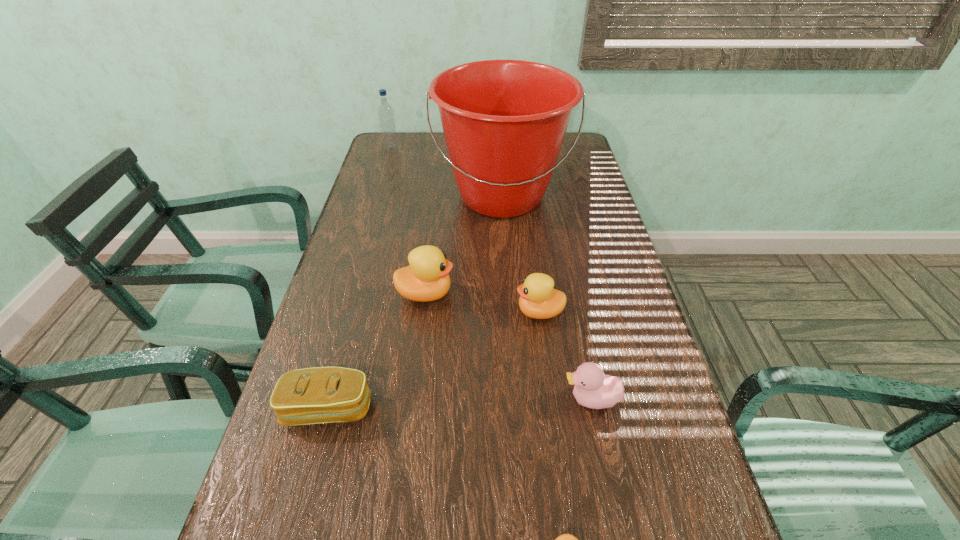
Image resolution: width=960 pixels, height=540 pixels. I want to click on water bottle located in the far edge section of the desktop, so click(x=386, y=118).

The height and width of the screenshot is (540, 960). What are the coordinates of `water bottle that is at the left edge` in the screenshot? It's located at (386, 118).

Where is `clutch bag present at the left edge`? clutch bag present at the left edge is located at coordinates (316, 395).

Locate an element on the screen. bucket at the right edge is located at coordinates (504, 121).

Where is `duckling present at the right edge`? duckling present at the right edge is located at coordinates (593, 389).

Identify the location of object positioned at the far left corner. The image size is (960, 540). (386, 118).

The image size is (960, 540). I want to click on object positioned at the far right corner, so click(504, 121).

In the image, there is a desktop. Identify the location of vacant space at the left edge. The image size is (960, 540). (353, 220).

Identify the location of vacant space at the right edge. The width and height of the screenshot is (960, 540). (569, 241).

The height and width of the screenshot is (540, 960). I want to click on free point at the far left corner, so click(x=384, y=154).